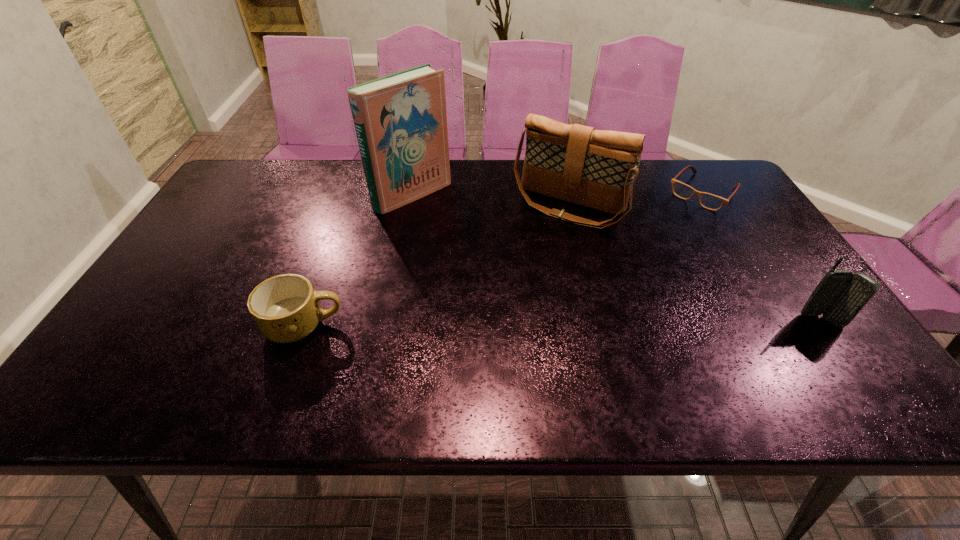
This screenshot has width=960, height=540. What are the coordinates of `object that is at the near edge` in the screenshot? It's located at (286, 308).

Locate an element on the screen. Image resolution: width=960 pixels, height=540 pixels. cellular telephone situated at the right edge is located at coordinates point(840,295).

This screenshot has height=540, width=960. Find the location of `spectacles positioned at the right edge`. spectacles positioned at the right edge is located at coordinates (709, 201).

This screenshot has height=540, width=960. Find the location of `object that is positioned at the far right corner`. object that is positioned at the far right corner is located at coordinates (709, 201).

You are a GUI agent. You are given a task and a screenshot of the screen. Output one action in this format:
    pyautogui.click(x=<x>, y=<y>)
    Task: Click on the vacant area at the far edge of the desktop
    The image size is (960, 540).
    Given the screenshot: What is the action you would take?
    pyautogui.click(x=473, y=163)

Image resolution: width=960 pixels, height=540 pixels. In the image, there is a desktop. Identify the location of blank space at the near edge. (622, 340).

Identify the location of vacant space at the left edge of the desktop. The image size is (960, 540). (171, 267).

The width and height of the screenshot is (960, 540). Find the location of `blank space at the right edge of the desktop`. blank space at the right edge of the desktop is located at coordinates click(x=717, y=242).

This screenshot has width=960, height=540. In order to click on vacant point at the far left corner in this screenshot , I will do `click(230, 198)`.

The width and height of the screenshot is (960, 540). Find the location of `free space at the far right corner of the desktop`. free space at the far right corner of the desktop is located at coordinates (673, 165).